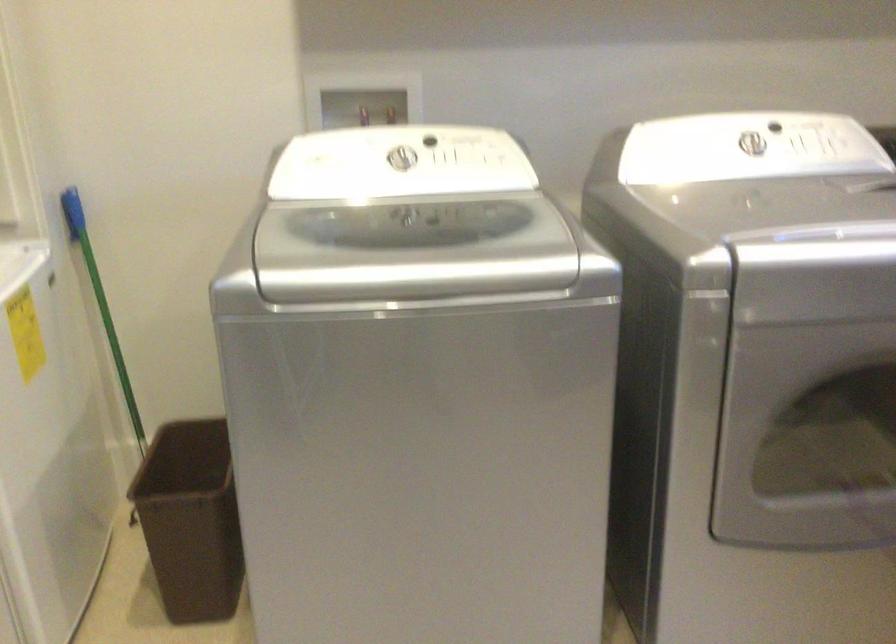
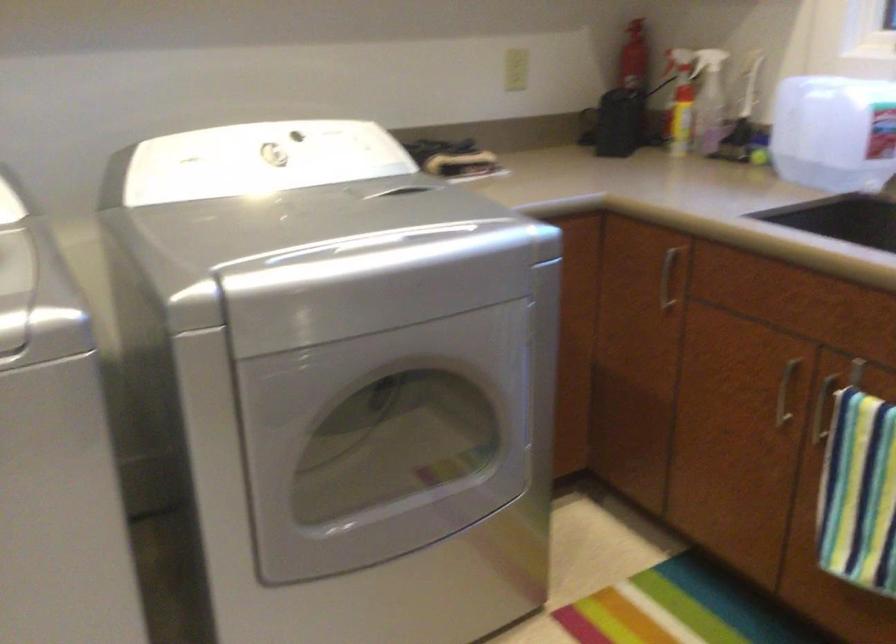
Question: Based on the continuous images, in which direction is the camera rotating? Reply with the corresponding letter.

Choices:
 (A) Left
 (B) Right
 (C) Up
 (D) Down

Answer: (B)